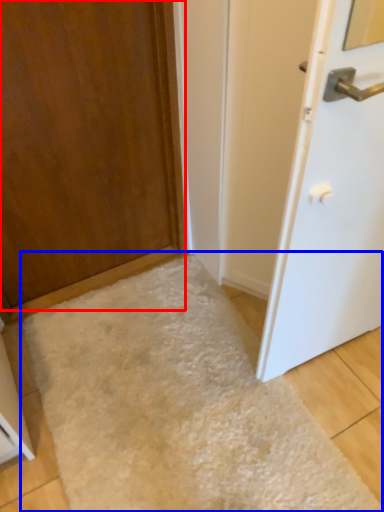
Question: Which object is further to the camera taking this photo, door (highlighted by a red box) or flour (highlighted by a blue box)?

Choices:
 (A) door
 (B) flour

Answer: (B)